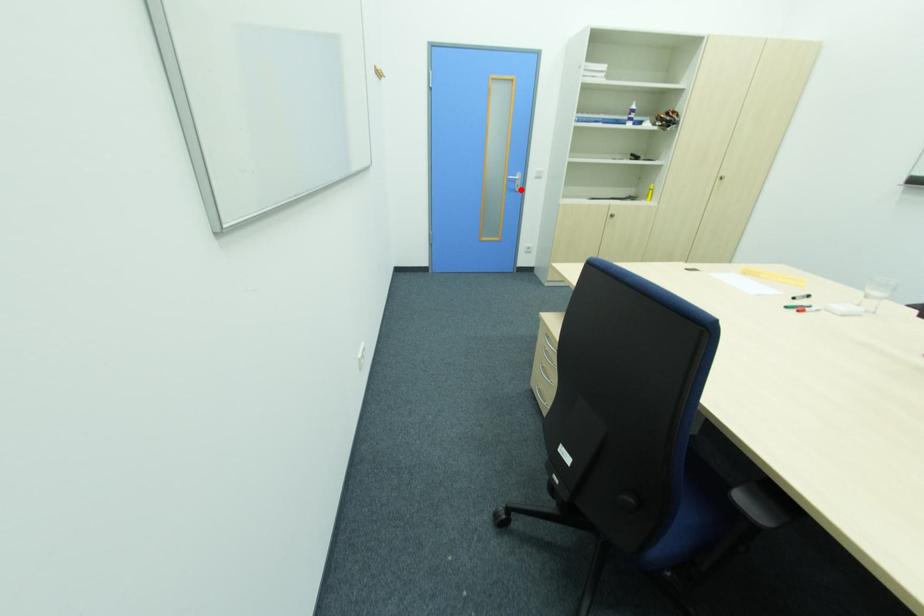
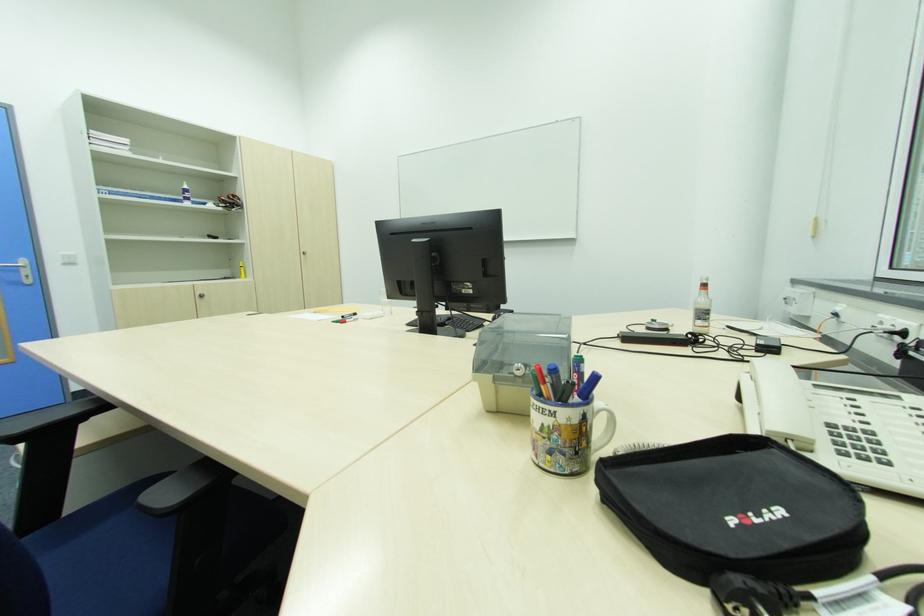
In the second image, find the point that corresponds to the highlighted location in the first image.

(30, 282)